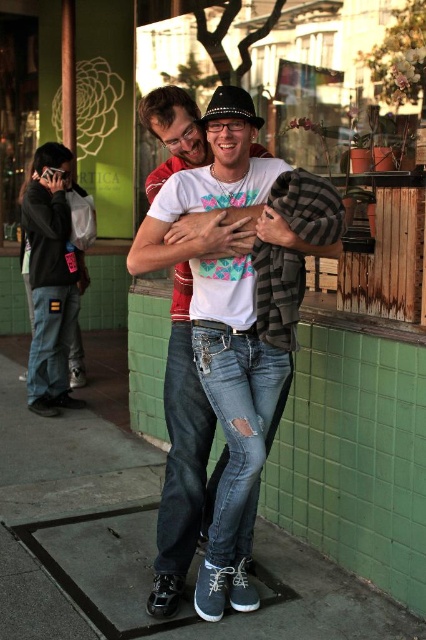
Question: Which object is the closest to the rough concrete sidewalk at center?

Choices:
 (A) denim pants at left
 (B) white matte t-shirt at center

Answer: (B)

Question: Estimate the real-world distances between objects in this image. Which object is closer to the rough concrete sidewalk at center?

Choices:
 (A) white matte t-shirt at center
 (B) denim pants at left

Answer: (A)

Question: In this image, where is rough concrete sidewalk at center located relative to denim pants at left?

Choices:
 (A) left
 (B) right

Answer: (B)

Question: Which point is farther to the camera?

Choices:
 (A) (23, 413)
 (B) (65, 180)
 (C) (164, 493)

Answer: (A)

Question: Is white matte t-shirt at center above denim pants at left?

Choices:
 (A) yes
 (B) no

Answer: (B)

Question: Is rough concrete sidewalk at center behind white matte t-shirt at center?

Choices:
 (A) yes
 (B) no

Answer: (A)